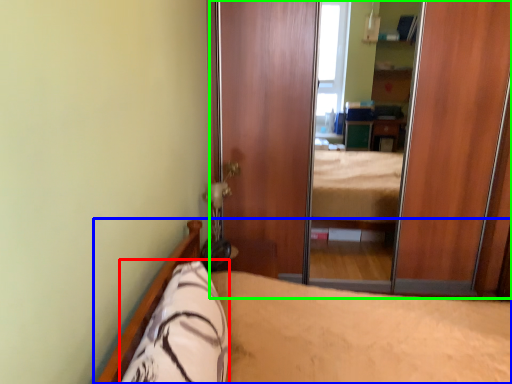
Question: Which object is positioned farthest from pillow (highlighted by a red box)? Select from bed (highlighted by a blue box) and screen door (highlighted by a green box).

Choices:
 (A) bed
 (B) screen door

Answer: (B)